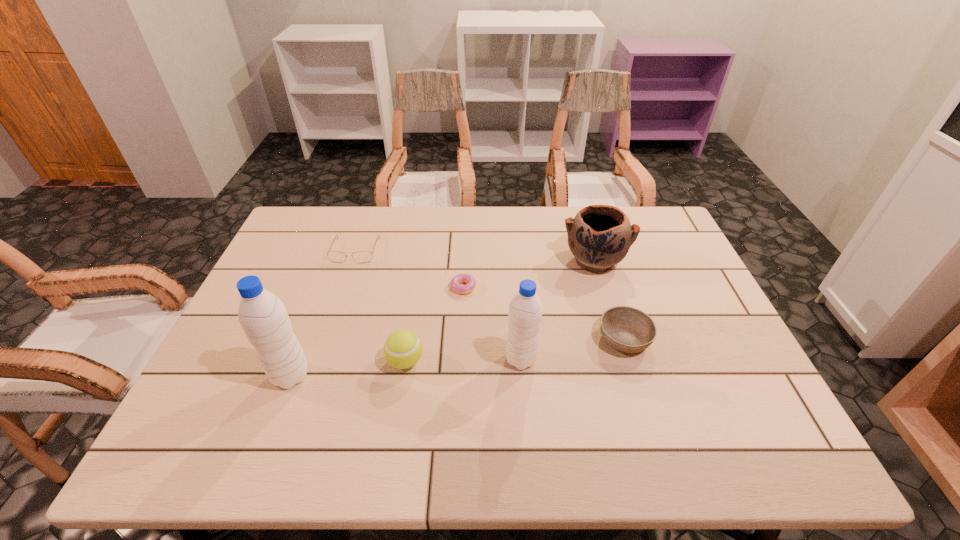
In order to click on blank area in the image that satisfies the following two spatial constraints: 1. on the front-facing side of the sixth tallest object; 2. on the right side of the third shortest object in this screenshot , I will do `click(325, 339)`.

Where is `free space that satisfies the following two spatial constraints: 1. on the back side of the doughnut; 2. on the left side of the tennis ball`? This screenshot has height=540, width=960. free space that satisfies the following two spatial constraints: 1. on the back side of the doughnut; 2. on the left side of the tennis ball is located at coordinates (417, 286).

Find the location of `free region that satisfies the following two spatial constraints: 1. on the front-facing side of the fifth shortest object; 2. on the right side of the sixth tallest object`. free region that satisfies the following two spatial constraints: 1. on the front-facing side of the fifth shortest object; 2. on the right side of the sixth tallest object is located at coordinates (351, 260).

The image size is (960, 540). In order to click on free region that satisfies the following two spatial constraints: 1. on the back side of the pottery; 2. on the right side of the tennis ball in this screenshot , I will do `click(420, 260)`.

You are a GUI agent. You are given a task and a screenshot of the screen. Output one action in this format:
    pyautogui.click(x=<x>, y=<y>)
    Task: Click on the free space that satisfies the following two spatial constraints: 1. on the front-facing side of the sixth tallest object; 2. on the left side of the pottery
    The width and height of the screenshot is (960, 540).
    Given the screenshot: What is the action you would take?
    pyautogui.click(x=351, y=260)

Locate an element on the screen. This screenshot has width=960, height=540. vacant space that satisfies the following two spatial constraints: 1. on the front-facing side of the spectacles; 2. on the right side of the tennis ball is located at coordinates (318, 361).